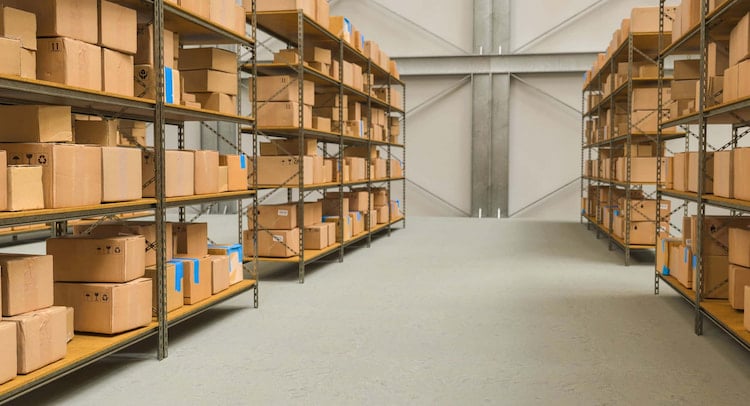
What are the coordinates of `racks` in the screenshot? It's located at (142, 242), (364, 129), (585, 146), (669, 192), (36, 234).